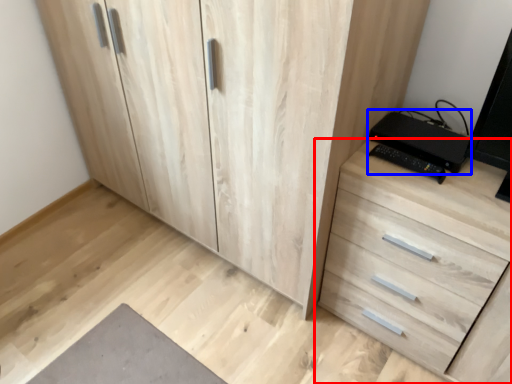
Question: Which of the following is the farthest to the observer, chest of drawers (highlighted by a red box) or computer (highlighted by a blue box)?

Choices:
 (A) chest of drawers
 (B) computer

Answer: (B)